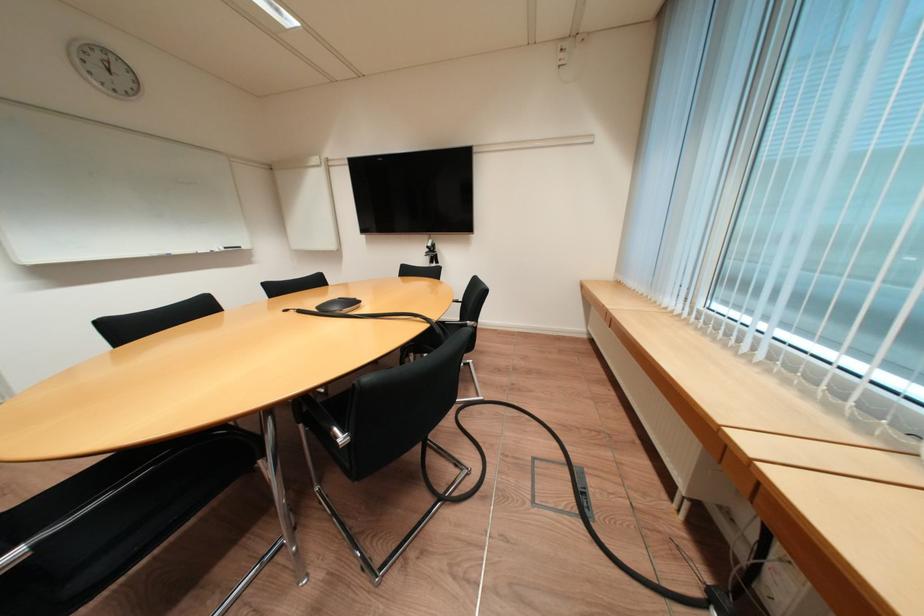
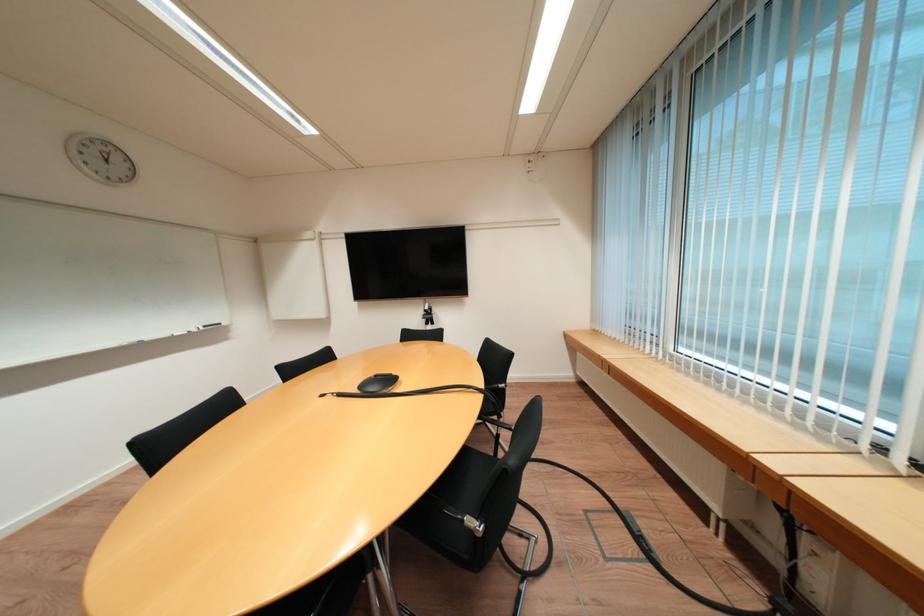
Question: The camera is either moving clockwise (left) or counter-clockwise (right) around the object. The first image is from the beginning of the video and the second image is from the end. Is the camera moving left or right when shooting the video?

Choices:
 (A) Left
 (B) Right

Answer: (A)